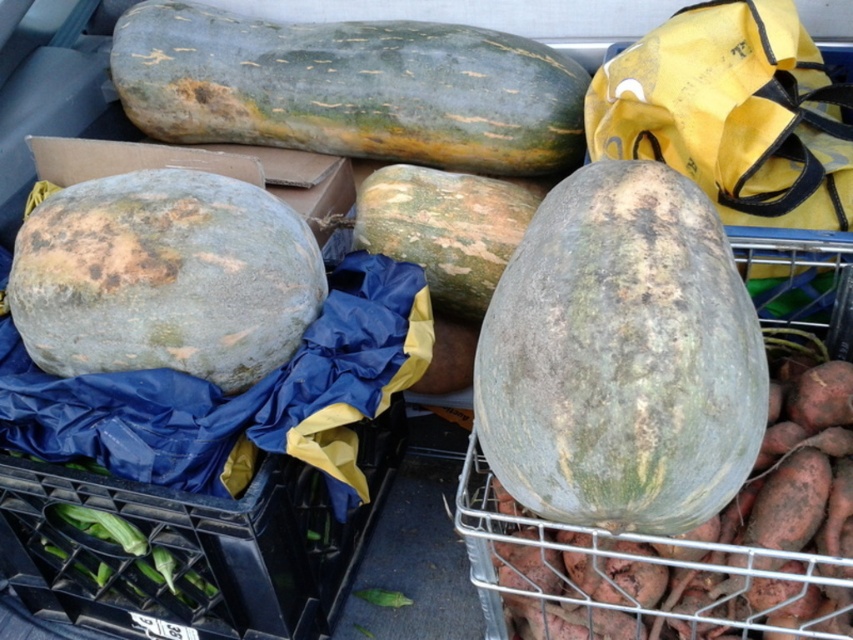
Describe the element at coordinates (350, 88) in the screenshot. This screenshot has height=640, width=853. I see `greenish-gray textured squash at upper center` at that location.

You are a GUI agent. You are given a task and a screenshot of the screen. Output one action in this format:
    pyautogui.click(x=<x>, y=<y>)
    Task: Click on the greenish-gray textured squash at upper center
    The width and height of the screenshot is (853, 640).
    Given the screenshot: What is the action you would take?
    pyautogui.click(x=350, y=88)

Who is taller, greenish-gray textured squash at upper center or green matte sweet potato at center?

Standing taller between the two is green matte sweet potato at center.

Does greenish-gray textured squash at upper center have a lesser width compared to green matte sweet potato at center?

No, greenish-gray textured squash at upper center is not thinner than green matte sweet potato at center.

Image resolution: width=853 pixels, height=640 pixels. What do you see at coordinates (350, 88) in the screenshot?
I see `greenish-gray textured squash at upper center` at bounding box center [350, 88].

Locate an element on the screen. greenish-gray textured squash at upper center is located at coordinates (350, 88).

Is speckled green cantaloupe at center positioned in front of greenish-gray textured squash at upper center?

Yes, it is in front of greenish-gray textured squash at upper center.

Is point (729, 264) closer to camera compared to point (368, 99)?

That is True.

Describe the element at coordinates (621, 356) in the screenshot. I see `speckled green cantaloupe at center` at that location.

Find the location of `speckled green cantaloupe at center`. speckled green cantaloupe at center is located at coordinates (621, 356).